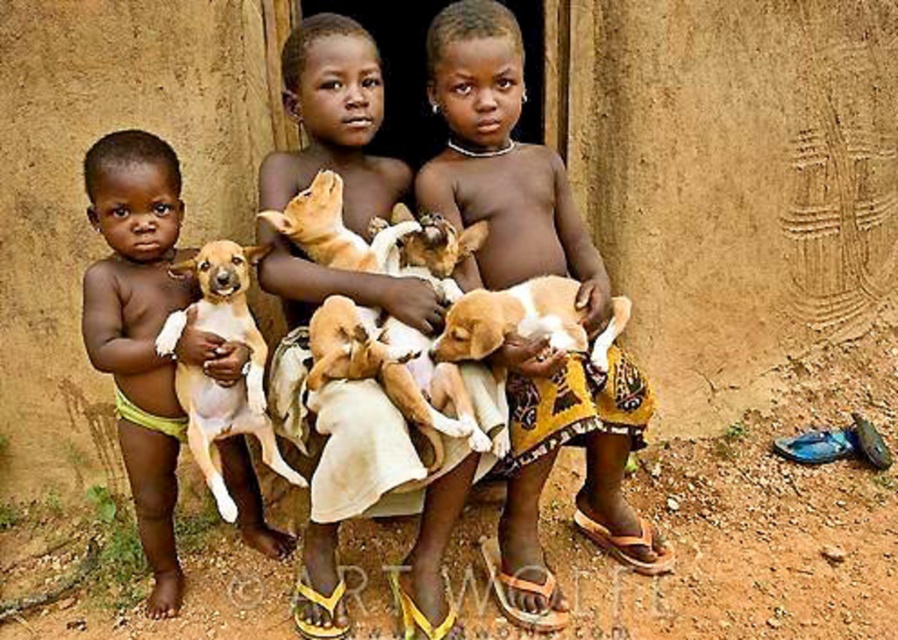
Can you confirm if brown fur dog at center is smaller than light brown fur dog at center?

No, brown fur dog at center is not smaller than light brown fur dog at center.

Which is more to the right, brown fur dog at center or light brown fur dog at center?

brown fur dog at center is more to the right.

What do you see at coordinates (500, 163) in the screenshot? I see `brown fur dog at center` at bounding box center [500, 163].

Where is `brown fur dog at center`? The height and width of the screenshot is (640, 898). brown fur dog at center is located at coordinates (500, 163).

Which is more to the left, brown fur dog at center or brown furry dog at left?

Positioned to the left is brown furry dog at left.

Is brown fur dog at center shorter than brown furry dog at left?

No.

Locate an element on the screen. This screenshot has width=898, height=640. brown fur dog at center is located at coordinates (500, 163).

I want to click on brown fur dog at center, so click(500, 163).

Who is more forward, (166, 486) or (295, 477)?

Positioned in front is point (295, 477).

From the picture: Can you confirm if light brown fur puppy at left is thinner than brown furry dog at left?

No.

Is point (148, 326) positioned before point (222, 308)?

No.

The image size is (898, 640). I want to click on light brown fur puppy at left, so click(145, 332).